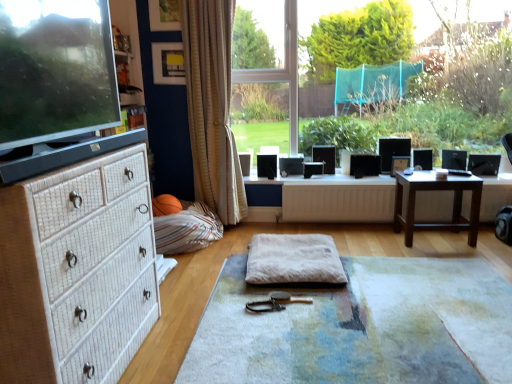
Question: From a real-world perspective, is matte black monitor at left positioned under beige striped curtain at center based on gravity?

Choices:
 (A) yes
 (B) no

Answer: (B)

Question: Does matte black monitor at left have a greater height compared to beige striped curtain at center?

Choices:
 (A) yes
 (B) no

Answer: (B)

Question: Considering the relative positions of matte black monitor at left and beige striped curtain at center in the image provided, is matte black monitor at left to the left of beige striped curtain at center from the viewer's perspective?

Choices:
 (A) no
 (B) yes

Answer: (B)

Question: Does matte black monitor at left have a lesser height compared to beige striped curtain at center?

Choices:
 (A) no
 (B) yes

Answer: (B)

Question: Can you confirm if matte black monitor at left is smaller than beige striped curtain at center?

Choices:
 (A) no
 (B) yes

Answer: (B)

Question: Based on their positions, is beige striped curtain at center located to the left or right of striped fabric bean bag at lower left?

Choices:
 (A) left
 (B) right

Answer: (B)

Question: Does point (214, 61) appear closer or farther from the camera than point (202, 203)?

Choices:
 (A) farther
 (B) closer

Answer: (B)

Question: From a real-world perspective, is beige striped curtain at center above or below striped fabric bean bag at lower left?

Choices:
 (A) below
 (B) above

Answer: (B)

Question: Relative to striped fabric bean bag at lower left, is beige striped curtain at center in front or behind?

Choices:
 (A) behind
 (B) front

Answer: (A)

Question: From a real-world perspective, relative to white wicker chest of drawers at left, is transparent glass window at center vertically above or below?

Choices:
 (A) above
 (B) below

Answer: (A)

Question: Based on their sizes in the image, would you say transparent glass window at center is bigger or smaller than white wicker chest of drawers at left?

Choices:
 (A) big
 (B) small

Answer: (A)

Question: In the image, is transparent glass window at center positioned in front of or behind white wicker chest of drawers at left?

Choices:
 (A) behind
 (B) front

Answer: (A)

Question: Is point (318, 38) closer or farther from the camera than point (50, 337)?

Choices:
 (A) closer
 (B) farther

Answer: (B)

Question: From a real-world perspective, relative to transparent glass window at center, is beige textured yoga mat at center, the 2th yoga mat when ordered from top to bottom, vertically above or below?

Choices:
 (A) above
 (B) below

Answer: (B)

Question: Is beige textured yoga mat at center, the 2th yoga mat when ordered from top to bottom, taller or shorter than transparent glass window at center?

Choices:
 (A) short
 (B) tall

Answer: (A)